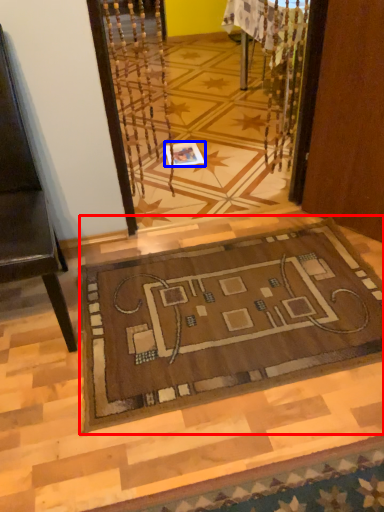
Question: Which of the following is the farthest to the observer, mat (highlighted by a red box) or square (highlighted by a blue box)?

Choices:
 (A) mat
 (B) square

Answer: (B)